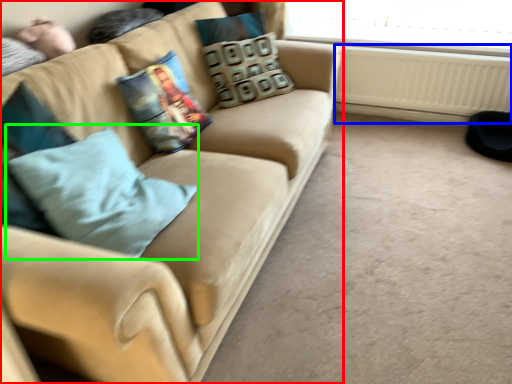
Question: Which object is the closest to the studio couch (highlighted by a red box)? Choose among these: radiator (highlighted by a blue box) or throw pillow (highlighted by a green box).

Choices:
 (A) radiator
 (B) throw pillow

Answer: (B)